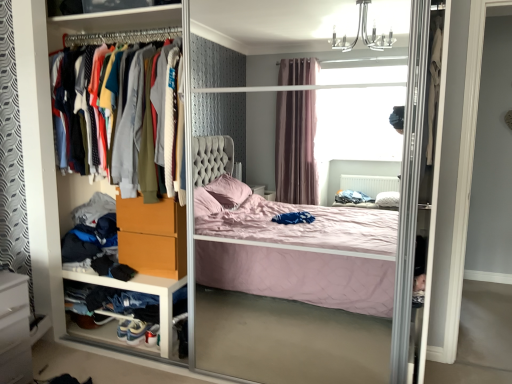
This screenshot has height=384, width=512. Describe the element at coordinates (249, 355) in the screenshot. I see `matte plastic screen door at center` at that location.

Locate an element on the screen. knit sweater at left is located at coordinates (128, 152).

At what (x,y) coordinates should I click in order to perform the action: click on white plastic drawer at lower left. Please return your answer as a coordinate pair (x, y). Looking at the image, I should click on (143, 292).

This screenshot has width=512, height=384. I want to click on shoe above the white suede sneaker at lower left, which appears as the 2th shoe when viewed from the right (from a real-world perspective), so click(x=136, y=331).

From a real-world perspective, which object rests below the other?

white suede sneaker at lower left, placed as the 1th shoe when sorted from left to right, from a real-world perspective.

Considering the relative sizes of white leather shoe at lower left, acting as the 2th shoe starting from the left, and white suede sneaker at lower left, placed as the 1th shoe when sorted from left to right, in the image provided, is white leather shoe at lower left, acting as the 2th shoe starting from the left, shorter than white suede sneaker at lower left, placed as the 1th shoe when sorted from left to right,?

Yes.

Which of these two, white leather shoe at lower left, acting as the 2th shoe starting from the left, or white suede sneaker at lower left, which appears as the 2th shoe when viewed from the right, is thinner?

Thinner between the two is white suede sneaker at lower left, which appears as the 2th shoe when viewed from the right.

Does matte plastic screen door at center lie behind white leather shoe at lower left, acting as the 2th shoe starting from the left?

No, the depth of matte plastic screen door at center is less than that of white leather shoe at lower left, acting as the 2th shoe starting from the left.

How much distance is there between matte plastic screen door at center and white leather shoe at lower left, which ranks as the 1th shoe in right-to-left order?

They are 28.88 inches apart.

Looking at this image, which of these two, matte plastic screen door at center or white leather shoe at lower left, acting as the 2th shoe starting from the left, stands taller?

matte plastic screen door at center.

Between matte plastic screen door at center and white leather shoe at lower left, acting as the 2th shoe starting from the left, which one has smaller width?

white leather shoe at lower left, acting as the 2th shoe starting from the left, is thinner.

Who is smaller, white leather shoe at lower left, acting as the 2th shoe starting from the left, or matte orange drawer at lower left?

white leather shoe at lower left, acting as the 2th shoe starting from the left.

How different are the orientations of white leather shoe at lower left, which ranks as the 1th shoe in right-to-left order, and matte orange drawer at lower left in degrees?

white leather shoe at lower left, which ranks as the 1th shoe in right-to-left order, and matte orange drawer at lower left are facing 6.01 degrees away from each other.

Where is `shoe that is the 1st object to the left of the matte orange drawer at lower left, starting at the anchor`? shoe that is the 1st object to the left of the matte orange drawer at lower left, starting at the anchor is located at coordinates (136, 331).

Is white leather shoe at lower left, which ranks as the 1th shoe in right-to-left order, far from matte orange drawer at lower left?

Actually, white leather shoe at lower left, which ranks as the 1th shoe in right-to-left order, and matte orange drawer at lower left are a little close together.

Is matte plastic screen door at center facing away from knit sweater at left?

Yes, matte plastic screen door at center is facing away from knit sweater at left.

Considering the relative positions of matte plastic screen door at center and knit sweater at left in the image provided, is matte plastic screen door at center to the left or to the right of knit sweater at left?

matte plastic screen door at center is to the right of knit sweater at left.

Is matte plastic screen door at center taller than knit sweater at left?

Yes, matte plastic screen door at center is taller than knit sweater at left.

Is matte plastic screen door at center bigger than matte orange drawer at lower left?

Yes, matte plastic screen door at center is bigger than matte orange drawer at lower left.

Could you tell me if matte plastic screen door at center is turned towards matte orange drawer at lower left?

Yes, matte plastic screen door at center faces towards matte orange drawer at lower left.

Which object is positioned more to the left, matte plastic screen door at center or matte orange drawer at lower left?

Positioned to the left is matte orange drawer at lower left.

Who is taller, matte orange drawer at lower left or white plastic drawer at lower left?

matte orange drawer at lower left.

Find the location of a particular element. The width and height of the screenshot is (512, 384). cabinet below the matte orange drawer at lower left (from a real-world perspective) is located at coordinates (143, 292).

Which of these two, matte orange drawer at lower left or white plastic drawer at lower left, is smaller?

matte orange drawer at lower left is smaller.

In the scene shown: From the image's perspective, is matte orange drawer at lower left on top of white plastic drawer at lower left?

Correct, matte orange drawer at lower left appears higher than white plastic drawer at lower left in the image.

Where is `vanity below the knit sweater at left (from a real-world perspective)`? vanity below the knit sweater at left (from a real-world perspective) is located at coordinates (14, 329).

Which is more to the right, white glossy vanity at lower left or knit sweater at left?

From the viewer's perspective, knit sweater at left appears more on the right side.

Can you tell me how much white glossy vanity at lower left and knit sweater at left differ in facing direction?

The angular difference between white glossy vanity at lower left and knit sweater at left is 90.5 degrees.

Is white glossy vanity at lower left oriented away from knit sweater at left?

That's not correct — white glossy vanity at lower left is not looking away from knit sweater at left.

Where is `shoe behind the white leather shoe at lower left, acting as the 2th shoe starting from the left`? The width and height of the screenshot is (512, 384). shoe behind the white leather shoe at lower left, acting as the 2th shoe starting from the left is located at coordinates (123, 329).

There is a white leather shoe at lower left, which ranks as the 1th shoe in right-to-left order. Identify the location of screen door above it (from a real-world perspective). (249, 355).

Looking at this image, which object lies further to the anchor point white glossy vanity at lower left, white suede sneaker at lower left, which appears as the 2th shoe when viewed from the right, or matte orange drawer at lower left?

The object further to white glossy vanity at lower left is white suede sneaker at lower left, which appears as the 2th shoe when viewed from the right.

Considering their positions, is white leather shoe at lower left, which ranks as the 1th shoe in right-to-left order, positioned closer to white glossy vanity at lower left than knit sweater at left?

white leather shoe at lower left, which ranks as the 1th shoe in right-to-left order, lies closer to white glossy vanity at lower left than the other object.

Considering their positions, is white glossy vanity at lower left positioned further to white leather shoe at lower left, which ranks as the 1th shoe in right-to-left order, than white suede sneaker at lower left, which appears as the 2th shoe when viewed from the right?

Among the two, white glossy vanity at lower left is located further to white leather shoe at lower left, which ranks as the 1th shoe in right-to-left order.

Based on their spatial positions, is white leather shoe at lower left, acting as the 2th shoe starting from the left, or white plastic drawer at lower left closer to white suede sneaker at lower left, which appears as the 2th shoe when viewed from the right?

Based on the image, white leather shoe at lower left, acting as the 2th shoe starting from the left, appears to be nearer to white suede sneaker at lower left, which appears as the 2th shoe when viewed from the right.

When comparing their distances from white plastic drawer at lower left, does white glossy vanity at lower left or knit sweater at left seem further?

knit sweater at left is positioned further to the anchor white plastic drawer at lower left.

From the image, which object appears to be nearer to matte orange drawer at lower left, white suede sneaker at lower left, placed as the 1th shoe when sorted from left to right, or matte plastic screen door at center?

Based on the image, white suede sneaker at lower left, placed as the 1th shoe when sorted from left to right, appears to be nearer to matte orange drawer at lower left.

Estimate the real-world distances between objects in this image. Which object is further from white leather shoe at lower left, acting as the 2th shoe starting from the left, matte orange drawer at lower left or matte plastic screen door at center?

The object further to white leather shoe at lower left, acting as the 2th shoe starting from the left, is matte plastic screen door at center.

Estimate the real-world distances between objects in this image. Which object is further from white suede sneaker at lower left, which appears as the 2th shoe when viewed from the right, white leather shoe at lower left, which ranks as the 1th shoe in right-to-left order, or knit sweater at left?

knit sweater at left is positioned further to the anchor white suede sneaker at lower left, which appears as the 2th shoe when viewed from the right.

At what (x,y) coordinates should I click in order to perform the action: click on screen door between knit sweater at left and white plastic drawer at lower left from top to bottom. Please return your answer as a coordinate pair (x, y). The width and height of the screenshot is (512, 384). Looking at the image, I should click on (249, 355).

Where is `screen door between knit sweater at left and white suede sneaker at lower left, which appears as the 2th shoe when viewed from the right, in the up-down direction`? The image size is (512, 384). screen door between knit sweater at left and white suede sneaker at lower left, which appears as the 2th shoe when viewed from the right, in the up-down direction is located at coordinates (249, 355).

Image resolution: width=512 pixels, height=384 pixels. I want to click on cabinet positioned between white glossy vanity at lower left and white leather shoe at lower left, which ranks as the 1th shoe in right-to-left order, from near to far, so click(x=143, y=292).

Locate an element on the screen. The height and width of the screenshot is (384, 512). shoe that lies between matte orange drawer at lower left and white leather shoe at lower left, acting as the 2th shoe starting from the left, from top to bottom is located at coordinates (123, 329).